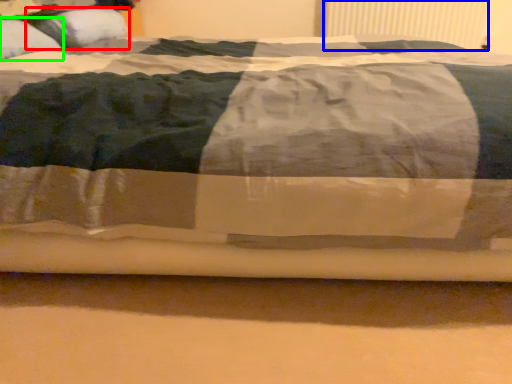
Question: Estimate the real-world distances between objects in this image. Which object is farther from pillow (highlighted by a red box), radiator (highlighted by a blue box) or pillow (highlighted by a green box)?

Choices:
 (A) radiator
 (B) pillow

Answer: (A)